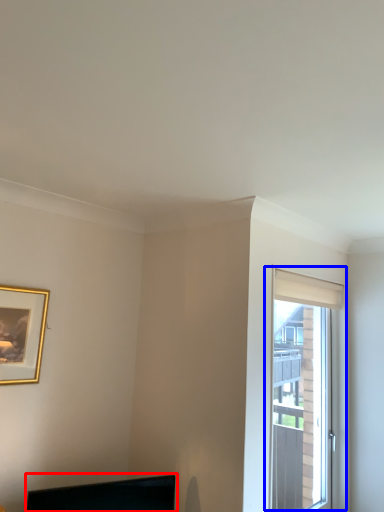
Question: Which object appears farthest to the camera in this image, computer monitor (highlighted by a red box) or window (highlighted by a blue box)?

Choices:
 (A) computer monitor
 (B) window

Answer: (B)